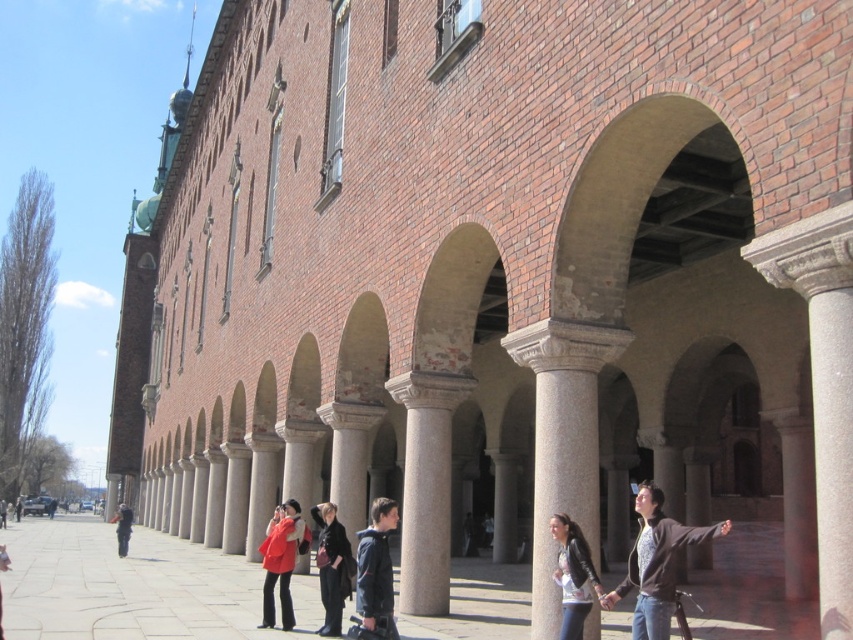
Can you confirm if matte red coat at center is bigger than dark gray jacket at lower left?

No.

Can you confirm if matte red coat at center is positioned above dark gray jacket at lower left?

Yes.

Is point (289, 604) positioned before point (115, 532)?

Yes, it is in front of point (115, 532).

Where is `matte red coat at center`? The image size is (853, 640). matte red coat at center is located at coordinates (281, 560).

Can you confirm if dark brown leather jacket at lower right is thinner than black leather jacket at center?

No.

Does point (688, 541) come in front of point (325, 516)?

Yes, it is in front of point (325, 516).

Does point (653, 572) come closer to viewer compared to point (346, 538)?

Yes, point (653, 572) is closer to viewer.

Identify the location of dark brown leather jacket at lower right. This screenshot has width=853, height=640. (656, 563).

Can you confirm if dark blue jacket at center is positioned to the left of matte red coat at center?

In fact, dark blue jacket at center is to the right of matte red coat at center.

Between dark blue jacket at center and matte red coat at center, which one appears on the right side from the viewer's perspective?

Positioned to the right is dark blue jacket at center.

Between point (357, 580) and point (274, 515), which one is positioned behind?

Positioned behind is point (274, 515).

Image resolution: width=853 pixels, height=640 pixels. Identify the location of dark blue jacket at center. (376, 572).